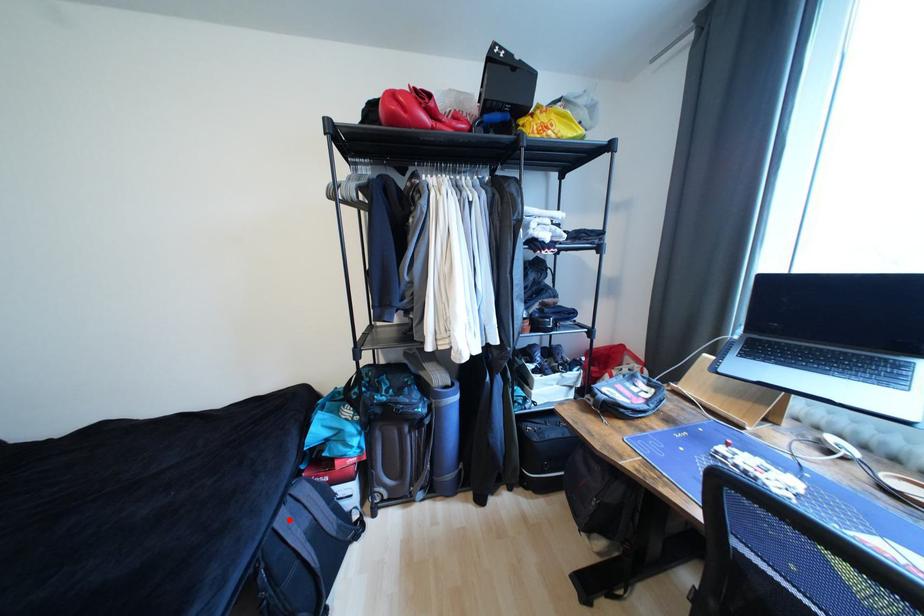
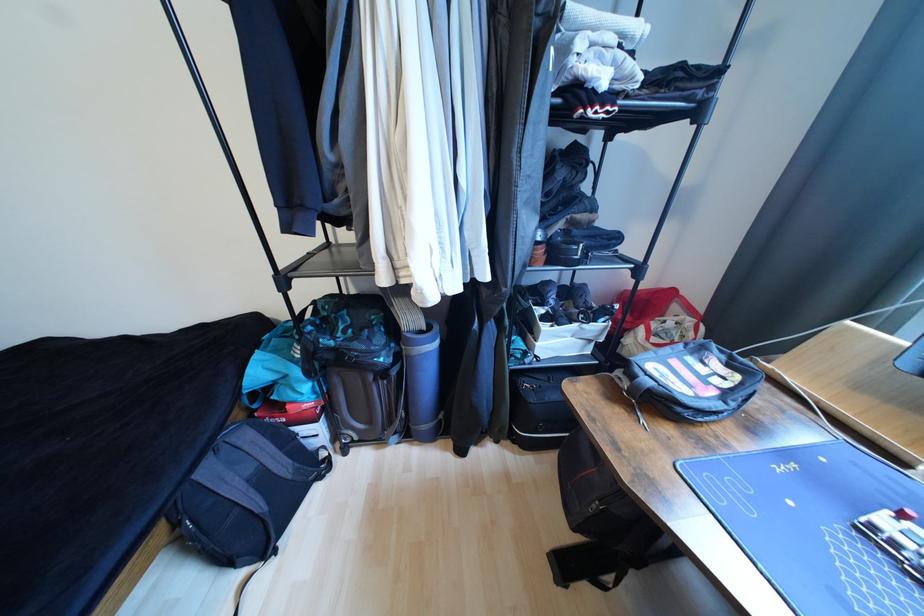
Find the pixel in the second image that matches the highlighted location in the first image.

(215, 472)